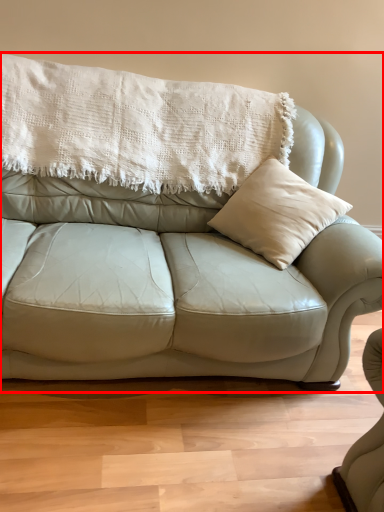
Question: From the image, what is the correct spatial relationship of studio couch (annotated by the red box) in relation to blanket?

Choices:
 (A) right
 (B) left

Answer: (A)